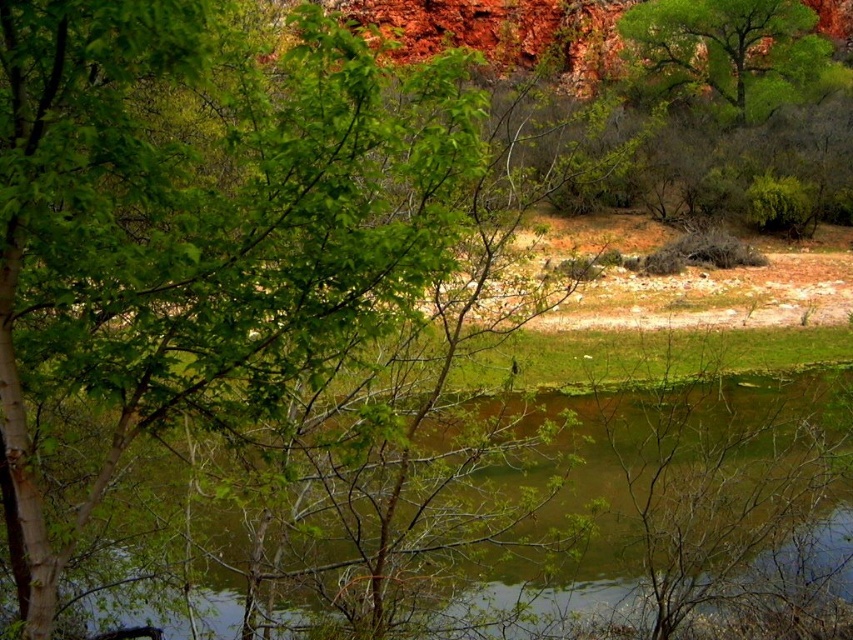
Which of these two, green murky water at center or green leafy tree at upper right, stands shorter?

With less height is green murky water at center.

Can you confirm if green murky water at center is wider than green leafy tree at upper right?

No, green murky water at center is not wider than green leafy tree at upper right.

Does point (498, 557) lie behind point (788, 61)?

That is False.

Locate an element on the screen. Image resolution: width=853 pixels, height=640 pixels. green murky water at center is located at coordinates (514, 516).